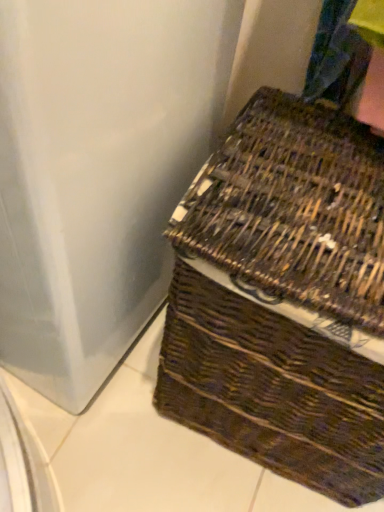
Question: Should I look upward or downward to see brown woven picnic basket at center?

Choices:
 (A) up
 (B) down

Answer: (B)